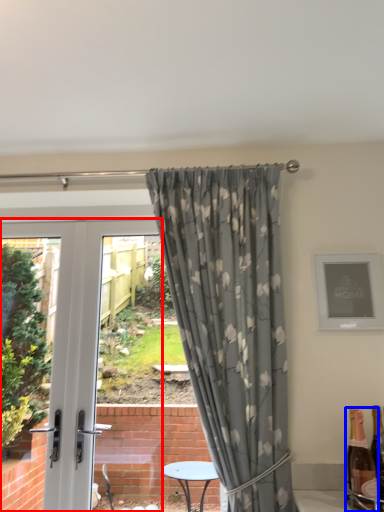
Question: Among these objects, which one is farthest to the camera, door (highlighted by a red box) or bottle (highlighted by a blue box)?

Choices:
 (A) door
 (B) bottle

Answer: (A)